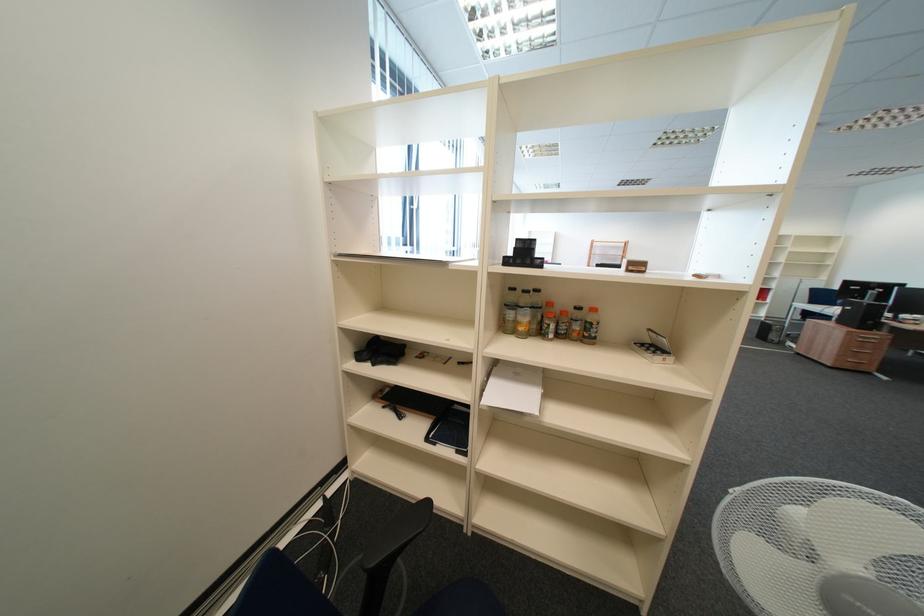
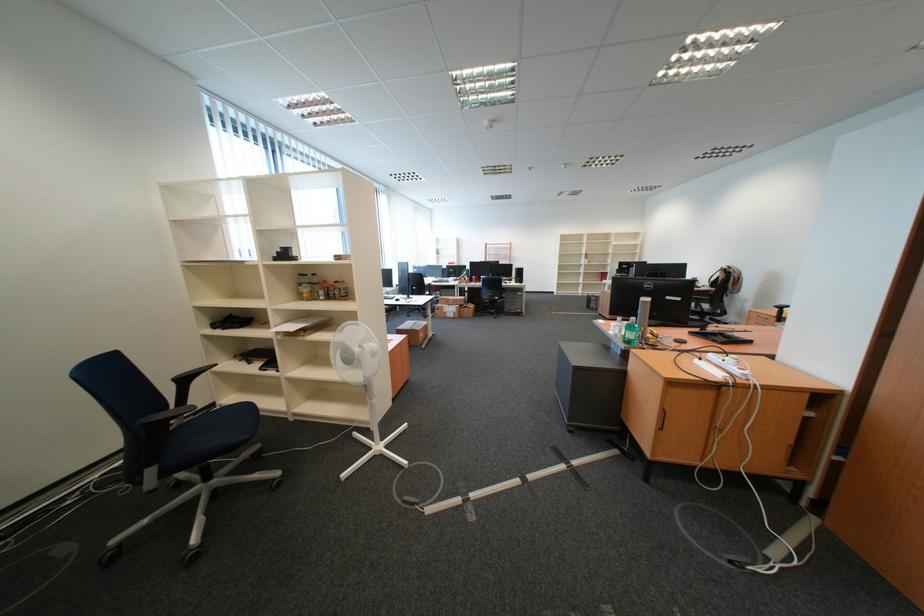
What movement of the cameraman would produce the second image?

The movement direction of the cameraman is right, backward.